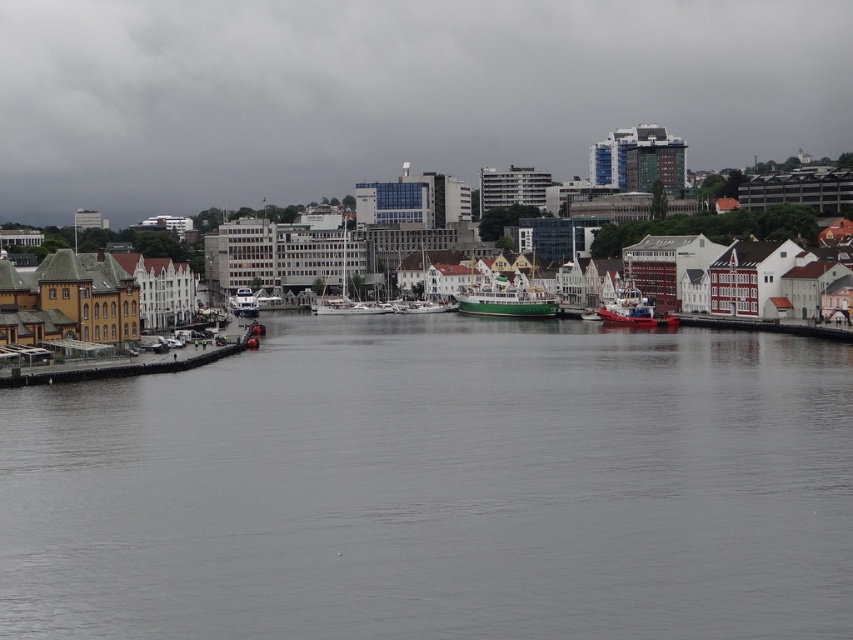
The width and height of the screenshot is (853, 640). In order to click on wooden dock at lower left in this screenshot , I will do `click(125, 368)`.

Does point (115, 372) come in front of point (437, 301)?

Yes, it is.

Is point (151, 368) closer to viewer compared to point (415, 282)?

Yes, point (151, 368) is closer to viewer.

Locate an element on the screen. wooden dock at lower left is located at coordinates (125, 368).

Does point (592, 333) come farther from viewer compared to point (241, 294)?

No, (592, 333) is in front of (241, 294).

Can you confirm if gray water at center is positioned below white glossy boat at center-left?

Correct, gray water at center is located below white glossy boat at center-left.

Describe the element at coordinates (438, 486) in the screenshot. The height and width of the screenshot is (640, 853). I see `gray water at center` at that location.

What are the coordinates of `gray water at center` in the screenshot? It's located at (438, 486).

This screenshot has height=640, width=853. I want to click on cloudy sky at upper center, so click(390, 92).

Which is behind, point (352, 72) or point (358, 307)?

Point (352, 72)

In order to click on cloudy sky at upper center in this screenshot , I will do `click(390, 92)`.